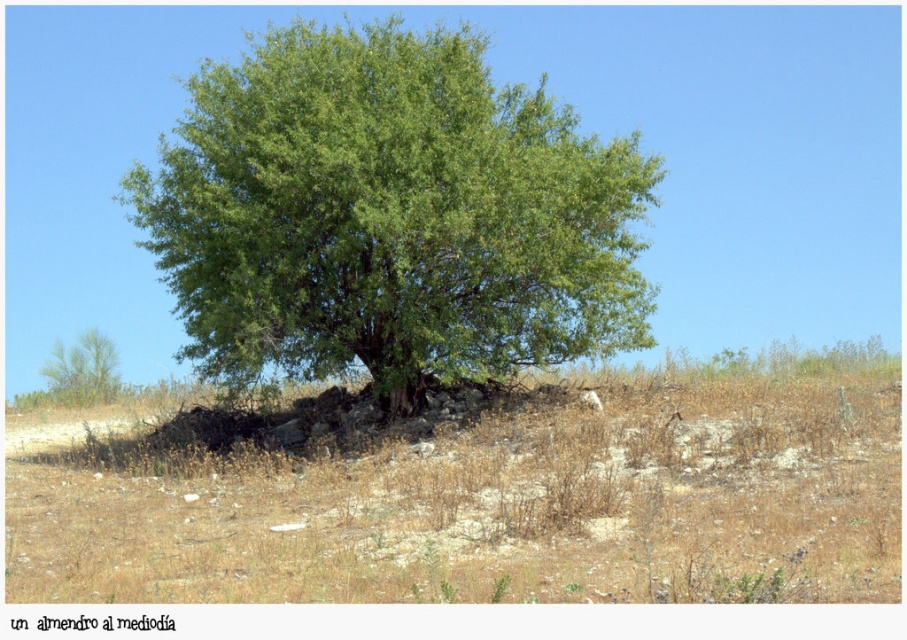
You are an environmental scientist studying the spatial arrangement of trees in a dry landscape. You observe the green leafy tree at center and the green leafy tree at lower left. Which tree is positioned higher up in the image?

The green leafy tree at center is located above the green leafy tree at lower left, so it is positioned higher up in the image.

You are a gardener who wants to water the green leafy tree at lower left. You notice brown dry grass at center nearby. Based on their positions, which direction should you move the sprinkler to reach the tree first?

The brown dry grass at center is located below the green leafy tree at lower left, so to reach the tree first, move the sprinkler upwards from the dry grass towards the tree.

Looking at this image, you are a gardener who wants to plant a new tree in this area. Considering the existing brown dry grass at center and the green leafy tree at lower left, which area would be better for planting a new tree? Please explain your reasoning based on the current vegetation.

The green leafy tree at lower left is thriving, indicating that the soil there is suitable for tree growth. The brown dry grass at center is larger in size, which might suggest it is overgrown or in a less fertile area. Therefore, planting near the green leafy tree at lower left would be better as it shows signs of healthy growth.